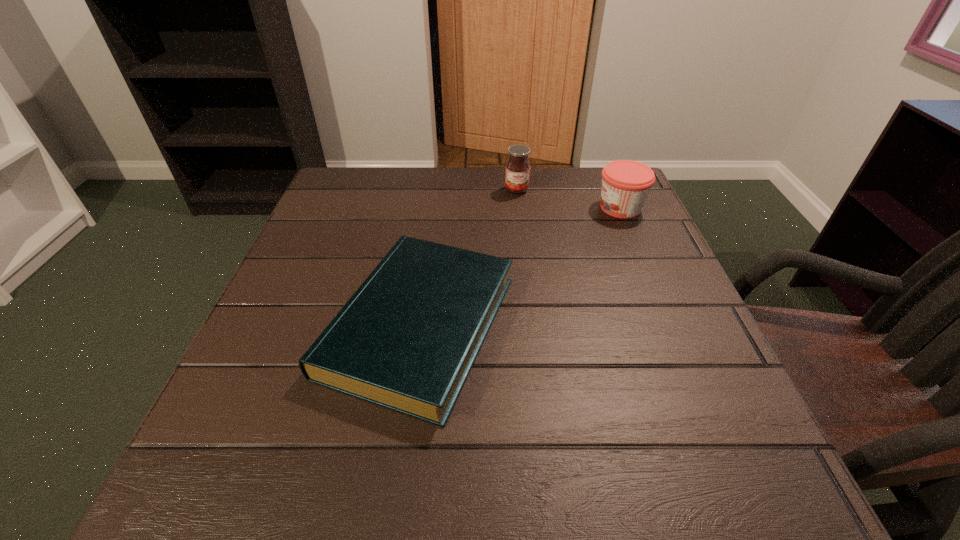
At what (x,y) coordinates should I click in order to perform the action: click on the left jam. Please return your answer as a coordinate pair (x, y). Looking at the image, I should click on (517, 175).

At what (x,y) coordinates should I click in order to perform the action: click on the rightmost object. Please return your answer as a coordinate pair (x, y). Looking at the image, I should click on [x=626, y=184].

In order to click on the nearest object in this screenshot , I will do `click(406, 340)`.

Image resolution: width=960 pixels, height=540 pixels. I want to click on the leftmost object, so click(406, 340).

I want to click on free space located on the label side of the second object from left to right, so click(527, 276).

In order to click on free space located 0.090m on the front label of the rightmost object in this screenshot , I will do `click(559, 207)`.

Where is `vacant space located on the front label of the rightmost object`? vacant space located on the front label of the rightmost object is located at coordinates (509, 207).

The width and height of the screenshot is (960, 540). I want to click on free space located on the front label of the rightmost object, so click(479, 207).

The width and height of the screenshot is (960, 540). Find the location of `free region located 0.070m on the left of the nearest object`. free region located 0.070m on the left of the nearest object is located at coordinates (285, 326).

You are a GUI agent. You are given a task and a screenshot of the screen. Output one action in this format:
    pyautogui.click(x=<x>, y=<y>)
    Task: Click on the object present at the left edge
    
    Given the screenshot: What is the action you would take?
    pyautogui.click(x=406, y=340)